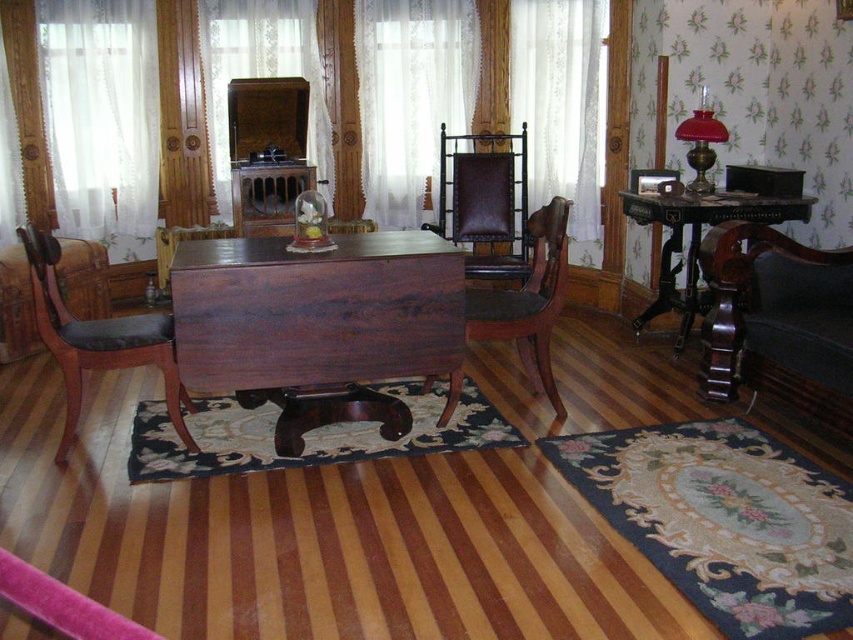
Question: Which of the following is the closest to the observer?

Choices:
 (A) (453, 147)
 (B) (138, 324)

Answer: (B)

Question: Is dark brown leather armchair at right behind black marble table at right?

Choices:
 (A) yes
 (B) no

Answer: (B)

Question: Among these points, which one is farthest from the camera?

Choices:
 (A) (486, 240)
 (B) (732, 237)
 (C) (120, 234)

Answer: (C)

Question: Which point is closer to the camera?

Choices:
 (A) (520, 348)
 (B) (105, 365)

Answer: (B)

Question: Can you confirm if mahogany leather armchair at left is positioned below brown leather chair at center?

Choices:
 (A) yes
 (B) no

Answer: (A)

Question: Is dark brown leather armchair at right further to camera compared to mahogany leather armchair at left?

Choices:
 (A) yes
 (B) no

Answer: (B)